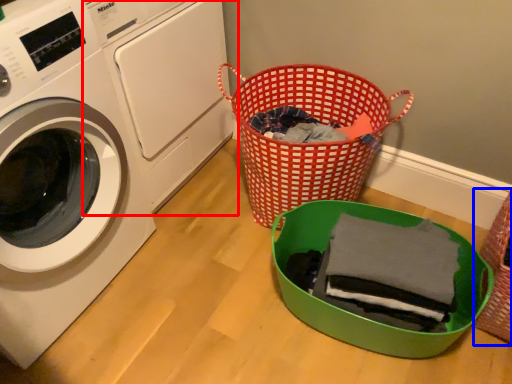
Question: Which point is closer to the camera, washing machine (highlighted by a red box) or basket (highlighted by a blue box)?

Choices:
 (A) washing machine
 (B) basket

Answer: (B)